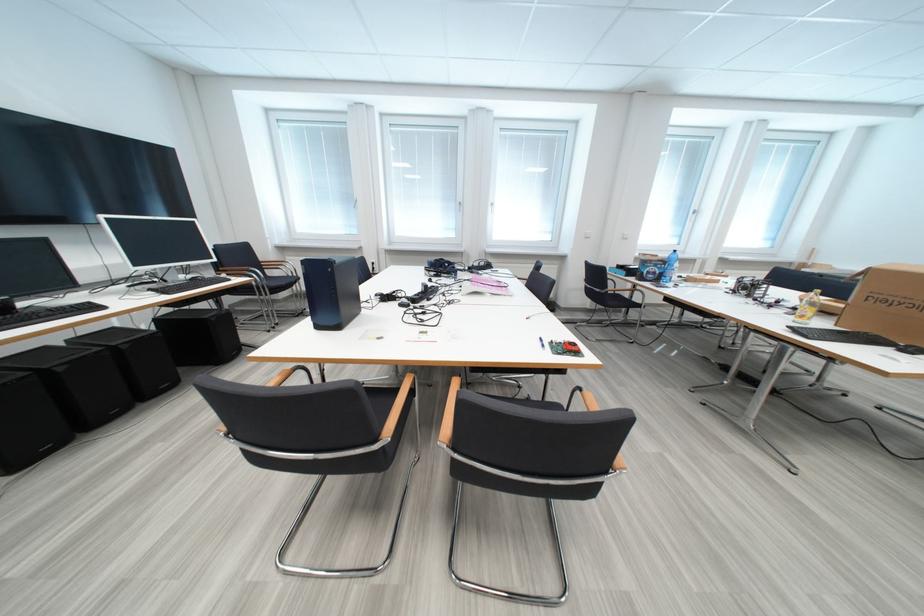
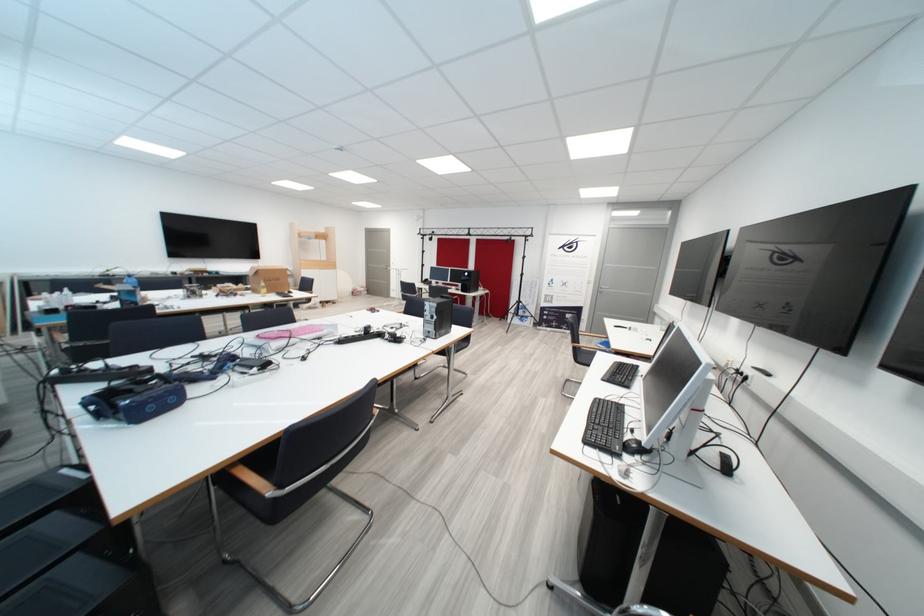
Question: I am providing you with two images of the same scene from different viewpoints. Which of the following objects are not visible in image2?

Choices:
 (A) barbell on rack
 (B) blue VR headset
 (C) black computer mouse
 (D) black computer speaker

Answer: (D)